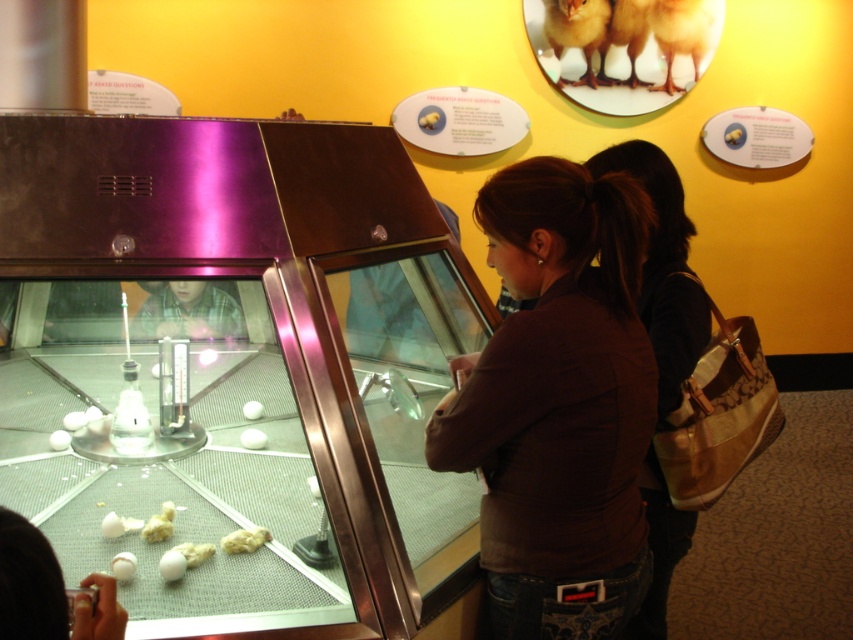
You are standing in front of the display case with the chicks and eggs. There are two points marked on the case. Which point is closer to you, point (505,266) or point (651,488)?

Point (505,266) is closer to the viewer than point (651,488).

You are a security guard in the museum and need to determine if the brown fabric shirt at center is taller than the brown fabric purse at center. Based on the scene, what is your observation?

The brown fabric shirt at center has a lesser height compared to the brown fabric purse at center, so the shirt is shorter than the purse.

You are standing at the point marked as point (x=558, y=404). What is the nearest object to you in the scene?

The nearest object to you at point (x=558, y=404) is the brown fabric shirt at center, as the coordinates correspond to that object.